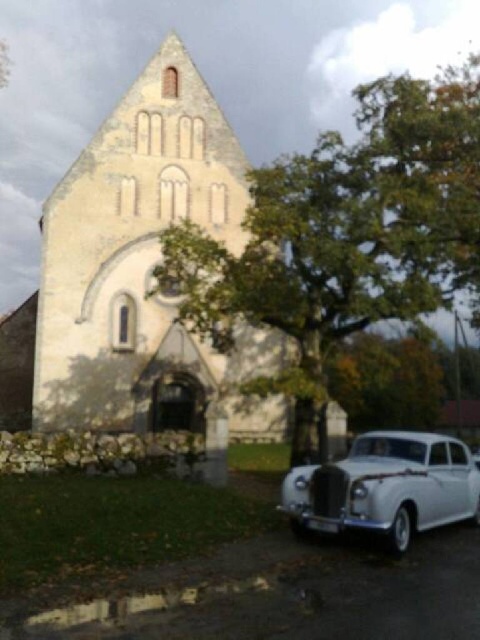
Does point (106, 259) lie in front of point (417, 451)?

No, it is behind (417, 451).

Does point (120, 314) lie behind point (321, 506)?

Yes, point (120, 314) is behind point (321, 506).

Measure the distance between point (238, 212) and camera.

They are 32.19 meters apart.

Image resolution: width=480 pixels, height=640 pixels. In order to click on light beige stone church at center in this screenshot , I will do `click(139, 259)`.

Can you confirm if green leafy tree at center is positioned to the right of light beige stone church at center?

Indeed, green leafy tree at center is positioned on the right side of light beige stone church at center.

Consider the image. Is green leafy tree at center shorter than light beige stone church at center?

In fact, green leafy tree at center may be taller than light beige stone church at center.

The image size is (480, 640). I want to click on green leafy tree at center, so click(x=345, y=236).

Is green leafy tree at center taller than white glossy sedan at lower right?

Indeed, green leafy tree at center has a greater height compared to white glossy sedan at lower right.

Does point (355, 177) come closer to viewer compared to point (469, 468)?

No, (355, 177) is further to viewer.

Identify the location of green leafy tree at center. The width and height of the screenshot is (480, 640). (345, 236).